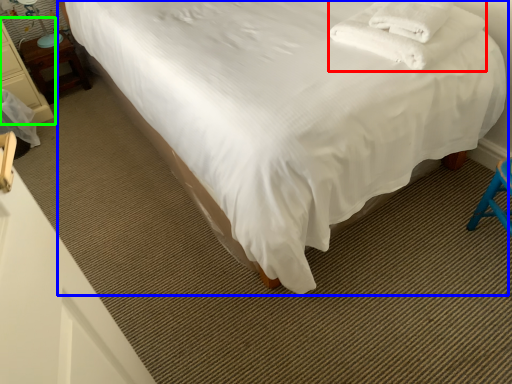
Question: Based on their relative distances, which object is nearer to blanket (highlighted by a red box)? Choose from bed (highlighted by a blue box) and furniture (highlighted by a green box).

Choices:
 (A) bed
 (B) furniture

Answer: (A)